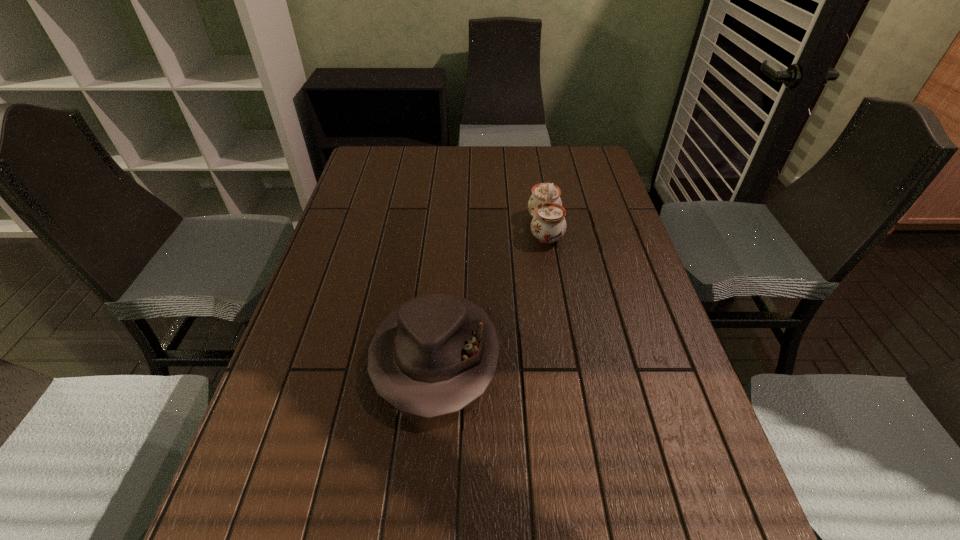
This screenshot has height=540, width=960. I want to click on vacant space at the right edge of the desktop, so click(x=635, y=320).

Locate an element on the screen. Image resolution: width=960 pixels, height=540 pixels. free space that satisfies the following two spatial constraints: 1. by the handle of the taller object; 2. on the decorative side of the hat is located at coordinates click(567, 356).

Where is `free spot that satisfies the following two spatial constraints: 1. by the handle of the chinaware; 2. on the decorative side of the left object`? free spot that satisfies the following two spatial constraints: 1. by the handle of the chinaware; 2. on the decorative side of the left object is located at coordinates (567, 356).

This screenshot has height=540, width=960. In order to click on free space that satisfies the following two spatial constraints: 1. by the handle of the farther object; 2. on the decorative side of the left object in this screenshot , I will do `click(567, 356)`.

You are a GUI agent. You are given a task and a screenshot of the screen. Output one action in this format:
    pyautogui.click(x=<x>, y=<y>)
    Task: Click on the vacant region that satisfies the following two spatial constraints: 1. by the handle of the right object; 2. on the decorative side of the nearer object
    This screenshot has width=960, height=540.
    Given the screenshot: What is the action you would take?
    pyautogui.click(x=567, y=356)

Find the location of a particular element. This screenshot has width=960, height=540. vacant space that satisfies the following two spatial constraints: 1. by the handle of the right object; 2. on the decorative side of the nearer object is located at coordinates (567, 356).

Find the location of a particular element. This screenshot has height=540, width=960. free space that satisfies the following two spatial constraints: 1. by the handle of the taller object; 2. on the decorative side of the left object is located at coordinates (567, 356).

Locate an element on the screen. free spot that satisfies the following two spatial constraints: 1. by the handle of the farther object; 2. on the decorative side of the nearer object is located at coordinates (567, 356).

Identify the location of blank area in the image that satisfies the following two spatial constraints: 1. by the handle of the farther object; 2. on the decorative side of the hat. (567, 356).

Where is `vacant space that satisfies the following two spatial constraints: 1. by the handle of the right object; 2. on the decorative side of the nearer object`? vacant space that satisfies the following two spatial constraints: 1. by the handle of the right object; 2. on the decorative side of the nearer object is located at coordinates (567, 356).